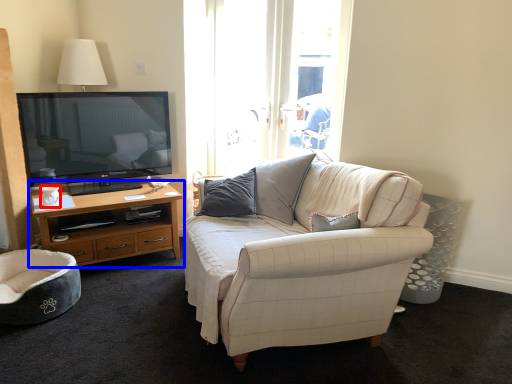
Question: Among these objects, which one is nearest to the camera, coffee cup (highlighted by a red box) or cabinetry (highlighted by a blue box)?

Choices:
 (A) coffee cup
 (B) cabinetry

Answer: (B)